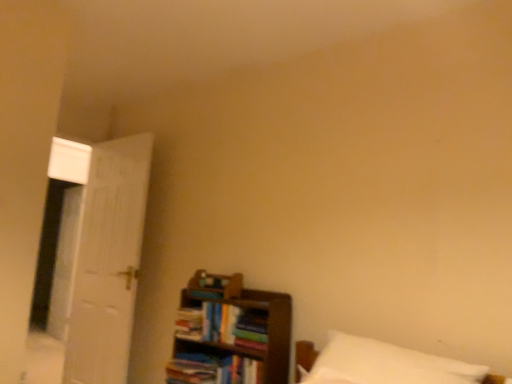
Question: From the image's perspective, would you say hardcover book at center, positioned as the fourth book in bottom-to-top order, is positioned over multicolored paper book at center, which is the third book from bottom to top?

Choices:
 (A) no
 (B) yes

Answer: (B)

Question: Does hardcover book at center, positioned as the fourth book in bottom-to-top order, have a smaller size compared to multicolored paper book at center, arranged as the 2th book when viewed from the top?

Choices:
 (A) no
 (B) yes

Answer: (B)

Question: Is hardcover book at center, acting as the first book starting from the top, in front of multicolored paper book at center, which is the third book from bottom to top?

Choices:
 (A) no
 (B) yes

Answer: (A)

Question: Is the surface of hardcover book at center, positioned as the fourth book in bottom-to-top order, in direct contact with multicolored paper book at center, which is the third book from bottom to top?

Choices:
 (A) yes
 (B) no

Answer: (B)

Question: Is hardcover book at center, acting as the first book starting from the top, facing away from multicolored paper book at center, which is the third book from bottom to top?

Choices:
 (A) no
 (B) yes

Answer: (A)

Question: From a real-world perspective, is hardcover book at center, positioned as the fourth book in bottom-to-top order, under multicolored paper book at center, which is the third book from bottom to top?

Choices:
 (A) yes
 (B) no

Answer: (B)

Question: From the image's perspective, does white soft pillow at lower right appear lower than hardcover book at center, which is the 1th book in bottom-to-top order?

Choices:
 (A) no
 (B) yes

Answer: (A)

Question: Is white soft pillow at lower right bigger than hardcover book at center, the 4th book positioned from the top?

Choices:
 (A) no
 (B) yes

Answer: (B)

Question: Would you say white soft pillow at lower right is outside hardcover book at center, which is the 1th book in bottom-to-top order?

Choices:
 (A) yes
 (B) no

Answer: (A)

Question: Is the depth of white soft pillow at lower right less than that of hardcover book at center, the 4th book positioned from the top?

Choices:
 (A) yes
 (B) no

Answer: (A)

Question: Considering the relative positions of white soft pillow at lower right and hardcover book at center, which is the 1th book in bottom-to-top order, in the image provided, is white soft pillow at lower right to the left of hardcover book at center, which is the 1th book in bottom-to-top order, from the viewer's perspective?

Choices:
 (A) yes
 (B) no

Answer: (B)

Question: Is white soft pillow at lower right next to hardcover book at center, the 4th book positioned from the top, and touching it?

Choices:
 (A) no
 (B) yes

Answer: (A)

Question: Does hardcover book at center, which is the 1th book in bottom-to-top order, turn towards white soft pillow at lower right?

Choices:
 (A) no
 (B) yes

Answer: (A)